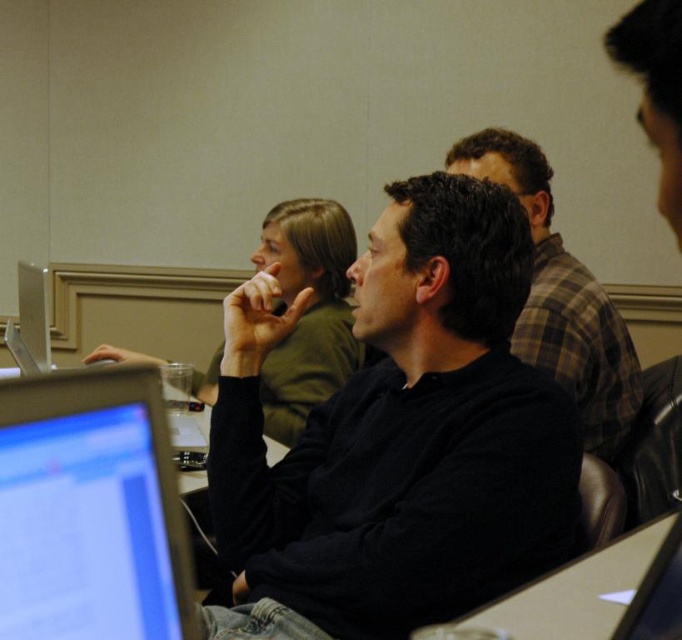
Question: Among these objects, which one is nearest to the camera?

Choices:
 (A) black matte shirt at center
 (B) plaid fabric shirt at upper center
 (C) matte black monitor at lower left

Answer: (C)

Question: Observing the image, what is the correct spatial positioning of matte black monitor at lower left in reference to plaid fabric shirt at upper center?

Choices:
 (A) right
 (B) left

Answer: (B)

Question: Considering the relative positions of black matte shirt at center and matte black monitor at lower left in the image provided, where is black matte shirt at center located with respect to matte black monitor at lower left?

Choices:
 (A) right
 (B) left

Answer: (A)

Question: Does black matte shirt at center appear on the left side of plaid fabric shirt at upper center?

Choices:
 (A) no
 (B) yes

Answer: (B)

Question: Which of the following is the farthest from the observer?

Choices:
 (A) pos(209,440)
 (B) pos(123,456)
 (C) pos(629,346)

Answer: (C)

Question: Which is nearer to the matte black monitor at lower left?

Choices:
 (A) black matte shirt at center
 (B) plaid fabric shirt at upper center

Answer: (A)